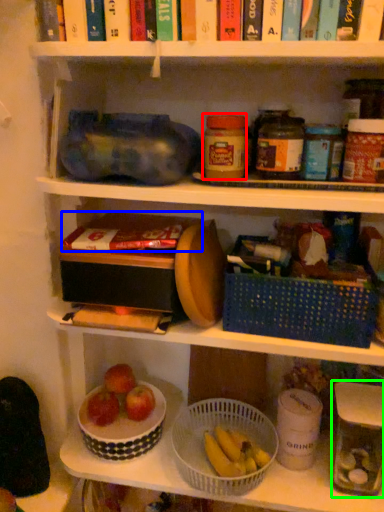
Question: Estimate the real-world distances between objects in this image. Which object is closer to bottle (highlighted by a red box), book (highlighted by a blue box) or glass jar (highlighted by a green box)?

Choices:
 (A) book
 (B) glass jar

Answer: (A)